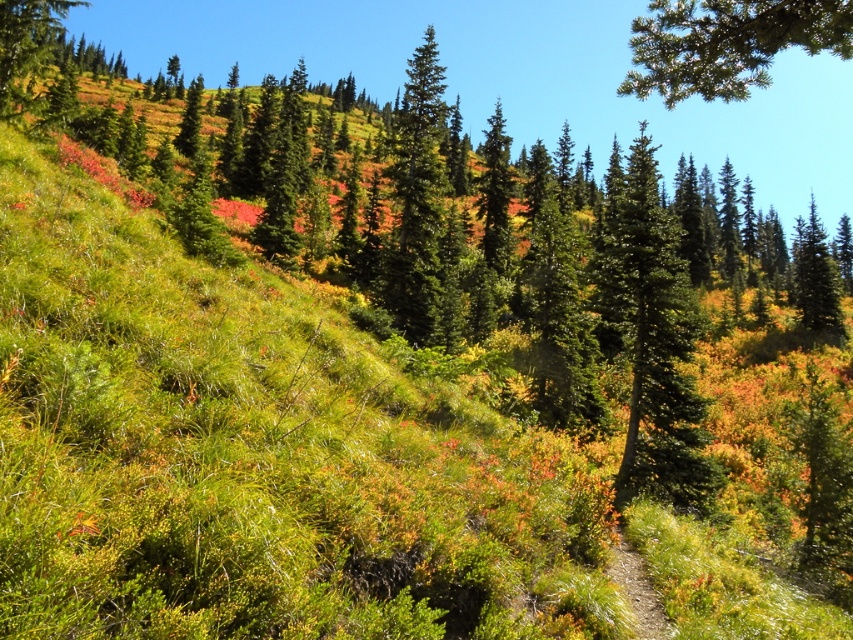
Can you confirm if green glossy tree at center is thinner than green needle-like at upper center?

Incorrect, green glossy tree at center's width is not less than green needle-like at upper center's.

Can you confirm if green glossy tree at center is shorter than green needle-like at upper center?

Yes, green glossy tree at center is shorter than green needle-like at upper center.

Which is behind, point (683, 493) or point (784, 38)?

Point (683, 493)

Identify the location of green glossy tree at center. (654, 339).

Between green glossy tree at center and green matte tree at upper left, which one is positioned lower?

Positioned lower is green glossy tree at center.

Does green glossy tree at center appear on the right side of green matte tree at upper left?

Indeed, green glossy tree at center is positioned on the right side of green matte tree at upper left.

You are a GUI agent. You are given a task and a screenshot of the screen. Output one action in this format:
    pyautogui.click(x=<x>, y=<y>)
    Task: Click on the green glossy tree at center
    The image size is (853, 640).
    Given the screenshot: What is the action you would take?
    pyautogui.click(x=654, y=339)

Can you confirm if green needle-like at upper center is bigger than green matte tree at upper left?

No.

Who is taller, green needle-like at upper center or green matte tree at upper left?

green matte tree at upper left is taller.

Is point (676, 10) positioned before point (41, 13)?

That is True.

The width and height of the screenshot is (853, 640). Find the location of `green needle-like at upper center`. green needle-like at upper center is located at coordinates (727, 44).